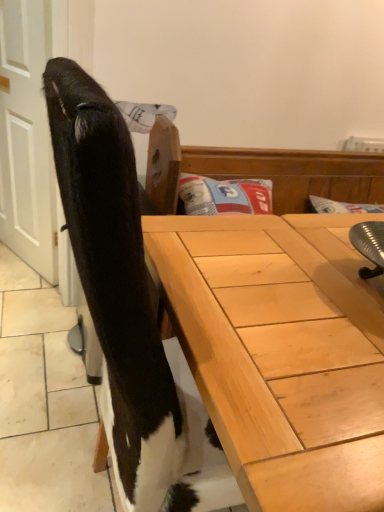
Where is `blank space situated above light wood desk at lower right (from a real-world perspective)`? blank space situated above light wood desk at lower right (from a real-world perspective) is located at coordinates (305, 286).